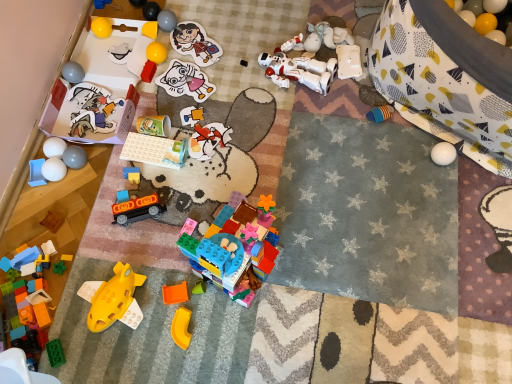
Identify the location of free space that is in between translucent orange plastic toy at center, the fourth toy in the right-to-left sequence, and orange matte train at center, which is the twelfth toy in right-to-left order. (163, 253).